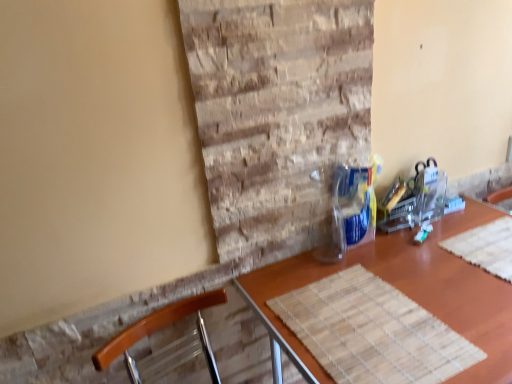
Question: Should I look upward or downward to see wooden chair at lower left?

Choices:
 (A) up
 (B) down

Answer: (B)

Question: Considering the relative sizes of wooden placemat at center and wooden chair at lower left in the image provided, is wooden placemat at center bigger than wooden chair at lower left?

Choices:
 (A) no
 (B) yes

Answer: (B)

Question: Is wooden placemat at center in contact with wooden chair at lower left?

Choices:
 (A) yes
 (B) no

Answer: (B)

Question: Does wooden placemat at center appear on the right side of wooden chair at lower left?

Choices:
 (A) yes
 (B) no

Answer: (A)

Question: Can you confirm if wooden placemat at center is thinner than wooden chair at lower left?

Choices:
 (A) yes
 (B) no

Answer: (B)

Question: Is wooden placemat at center shorter than wooden chair at lower left?

Choices:
 (A) yes
 (B) no

Answer: (B)

Question: Considering the relative sizes of wooden placemat at center and wooden chair at lower left in the image provided, is wooden placemat at center taller than wooden chair at lower left?

Choices:
 (A) yes
 (B) no

Answer: (A)

Question: From a real-world perspective, is wooden chair at lower left on wooden placemat at center?

Choices:
 (A) yes
 (B) no

Answer: (A)

Question: Can you confirm if wooden chair at lower left is shorter than wooden placemat at center?

Choices:
 (A) yes
 (B) no

Answer: (A)

Question: From a real-world perspective, is wooden chair at lower left under wooden placemat at center?

Choices:
 (A) no
 (B) yes

Answer: (A)

Question: From the image's perspective, is wooden chair at lower left located beneath wooden placemat at center?

Choices:
 (A) no
 (B) yes

Answer: (A)

Question: Is wooden chair at lower left taller than wooden placemat at center?

Choices:
 (A) no
 (B) yes

Answer: (A)

Question: From the image's perspective, is wooden chair at lower left above wooden placemat at center?

Choices:
 (A) no
 (B) yes

Answer: (B)

Question: In terms of width, does wooden chair at lower left look wider or thinner when compared to wooden placemat at center?

Choices:
 (A) wide
 (B) thin

Answer: (B)